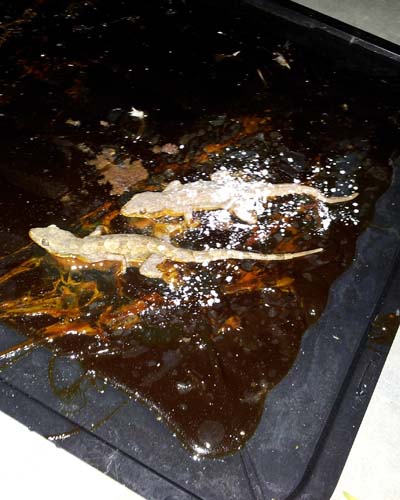
At what (x,y) coordinates should I click in order to perform the action: click on mat. Please return your answer as a coordinate pair (x, y). This screenshot has width=400, height=500. Looking at the image, I should click on (280, 417).